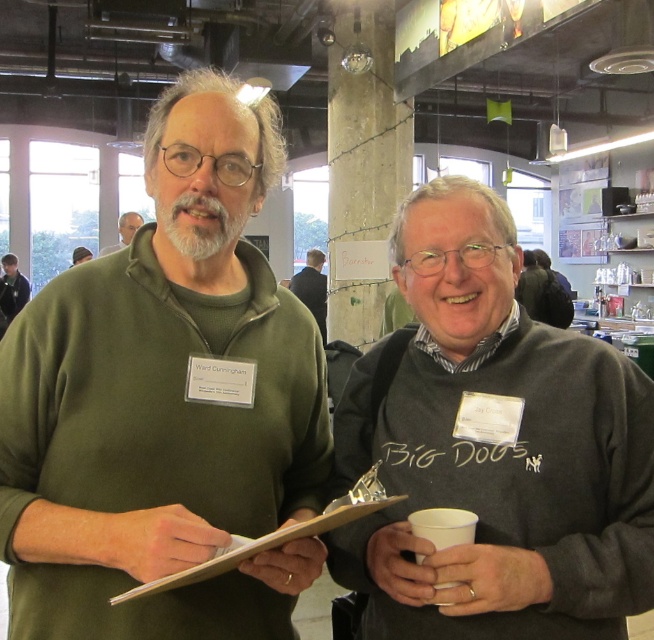
You are a photographer at an event and want to take a photo that includes both the dark blue shirt at left and the matte green sweater at center. Which person should you position closer to the camera to ensure both are in focus?

You should position the dark blue shirt at left closer to the camera since it is already further away than the matte green sweater at center, ensuring both are within the focal range.

You are at a conference and want to approach the person wearing the matte green sweater at center. Which direction should you move from the dark blue shirt at left to reach them?

To reach the matte green sweater at center from the dark blue shirt at left, you should move to the right since the dark blue shirt at left is to the left of the matte green sweater at center.

You are standing at the point marked by the coordinates point (322, 326) in the image, which is part of a conference scene with two people. You want to know if you can comfortably walk to the exit door located 8 meters away from your current position. Can you reach the door without needing to move more than 6.62 meters?

The distance between you and the point marked as point (322, 326) is 6.62 meters. Since the exit door is 8 meters away from your current position, you would need to move an additional 1.38 meters beyond the point to reach it, which exceeds the 6.62 meters limit. Therefore, you cannot reach the door without moving more than 6.62 meters.